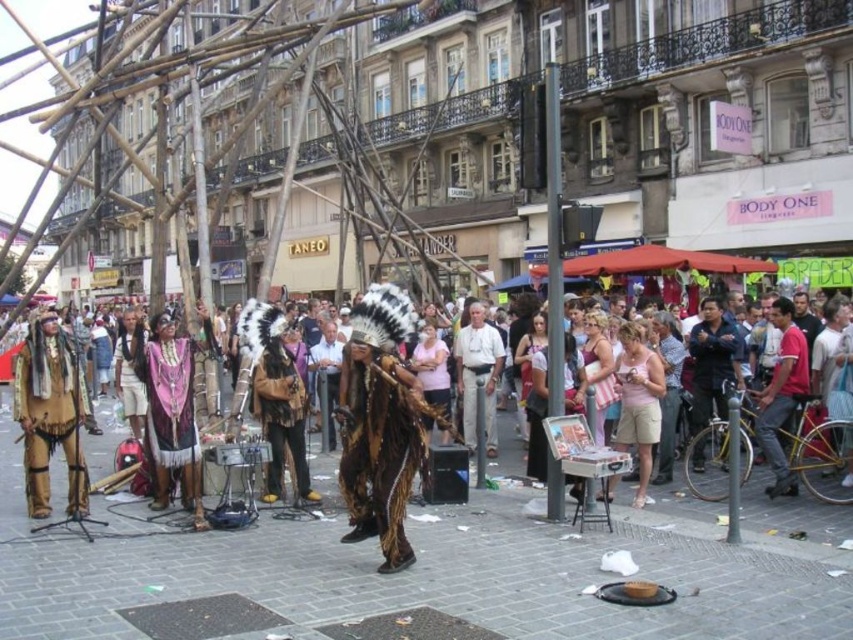
You are a photographer trying to capture the central performers. You notice the brown furry headdress at center and the red shirt at center. Which of these two items has a greater width in the image?

The brown furry headdress at center has a greater width than the red shirt at center.

You are a photographer trying to capture the performers. You notice the brown leather headdress at center and the light beige pants at center. Which object should you focus on to ensure it fits entirely within your camera frame if the frame can only accommodate the smaller object?

The brown leather headdress at center occupies less space than the light beige pants at center, so you should focus on the brown leather headdress at center to ensure it fits entirely within your camera frame.

You are a photographer trying to capture the performer at the center. The light beige pants at center and the leather fringe headdress at center are both important elements. Which one should you focus on first if you want to ensure the headdress is in the frame before the pants?

You should focus on the leather fringe headdress at center first since it is on the left side of the light beige pants at center, so it will come into view first as you pan from left to right.